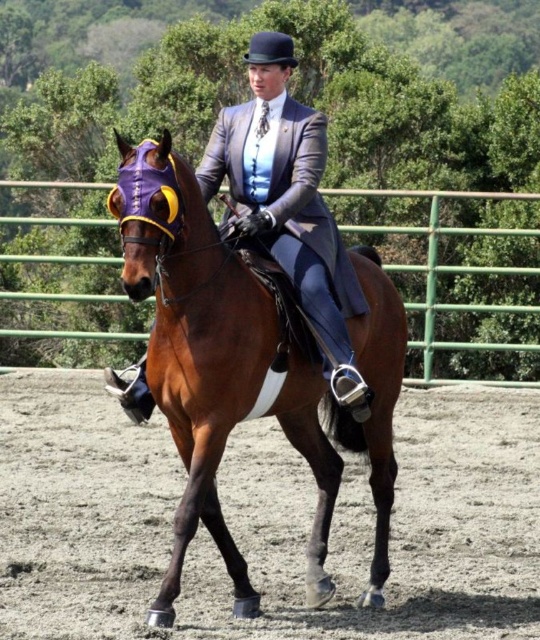
You are an equestrian rider preparing for a competition. You need to navigate your horse along the brown sandy dirt track at center and avoid the green metal fence at center. Based on the scene description, which direction should you steer your horse to stay on the track and avoid the fence?

Result: The brown sandy dirt track at center is to the left of the green metal fence at center, so you should steer your horse to the left to stay on the track and avoid the fence.

You are standing in the middle of the arena and see two points marked in the image. Which point is closer to you, point (459, 458) or point (126, 221)?

Point (459, 458) is further to the viewer than point (126, 221), so the closer point to you is point (126, 221).

Looking at this image, you are a photographer standing at the center of the arena. You want to take a photo of the brown glossy horse at center. Where should you position yourself to capture the horse in the frame?

The brown glossy horse at center is located at point [246,368], so you should position yourself at the center of the arena to capture the horse in the frame.